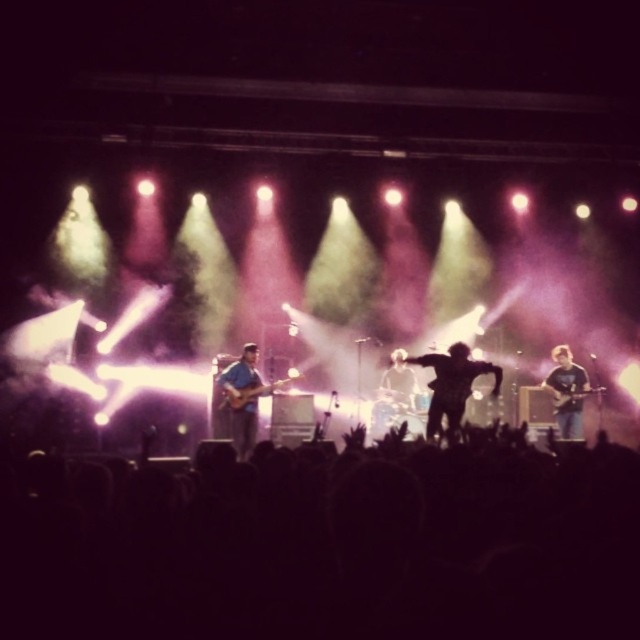
From the picture: Between matte blue guitar at center-left and blue denim jeans at right, which one is positioned higher?

blue denim jeans at right is higher up.

Does matte blue guitar at center-left appear under blue denim jeans at right?

Indeed, matte blue guitar at center-left is positioned under blue denim jeans at right.

At what (x,y) coordinates should I click in order to perform the action: click on matte blue guitar at center-left. Please return your answer as a coordinate pair (x, y). Looking at the image, I should click on (243, 397).

Where is `matte blue guitar at center-left`? matte blue guitar at center-left is located at coordinates (243, 397).

Can you confirm if matte blue guitar at center-left is bigger than dark blue shirt at center?

Incorrect, matte blue guitar at center-left is not larger than dark blue shirt at center.

Between matte blue guitar at center-left and dark blue shirt at center, which one has more height?

matte blue guitar at center-left is taller.

Does point (256, 369) lie behind point (378, 416)?

No.

In order to click on matte blue guitar at center-left in this screenshot , I will do `click(243, 397)`.

Is matte blue guitar at center-left above wooden acoustic guitar at right?

Incorrect, matte blue guitar at center-left is not positioned above wooden acoustic guitar at right.

Is matte blue guitar at center-left to the left of wooden acoustic guitar at right from the viewer's perspective?

Correct, you'll find matte blue guitar at center-left to the left of wooden acoustic guitar at right.

The image size is (640, 640). I want to click on matte blue guitar at center-left, so click(x=243, y=397).